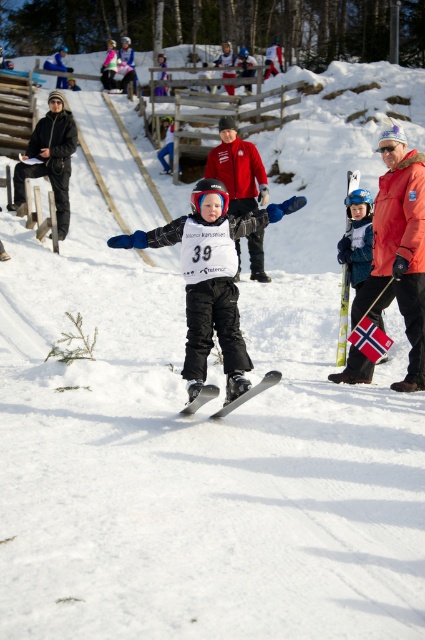
Question: Is yellow metallic ski at right closer to the viewer compared to matte black skis at center?

Choices:
 (A) no
 (B) yes

Answer: (A)

Question: Does matte black snowboard at center appear over matte black skis at center?

Choices:
 (A) no
 (B) yes

Answer: (B)

Question: Based on their relative distances, which object is nearer to the matte black snowboard at center?

Choices:
 (A) yellow metallic ski at right
 (B) matte black skis at center

Answer: (B)

Question: Can you confirm if yellow metallic ski at right is smaller than matte black skis at center?

Choices:
 (A) no
 (B) yes

Answer: (A)

Question: Among these points, which one is nearest to the camera?

Choices:
 (A) (203, 282)
 (B) (337, 355)

Answer: (A)

Question: Which object is positioned farthest from the matte black skis at center?

Choices:
 (A) matte black snowboard at center
 (B) yellow metallic ski at right

Answer: (B)